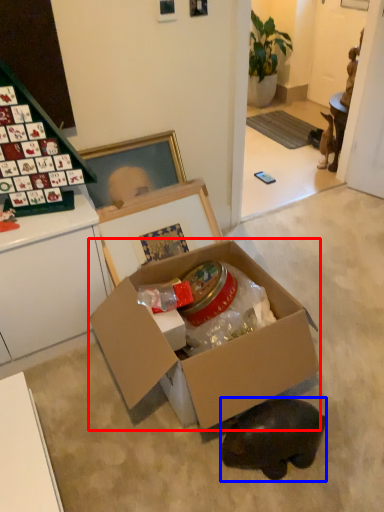
Question: Which of the following is the farthest to the observer, box (highlighted by a red box) or animal (highlighted by a blue box)?

Choices:
 (A) box
 (B) animal

Answer: (B)